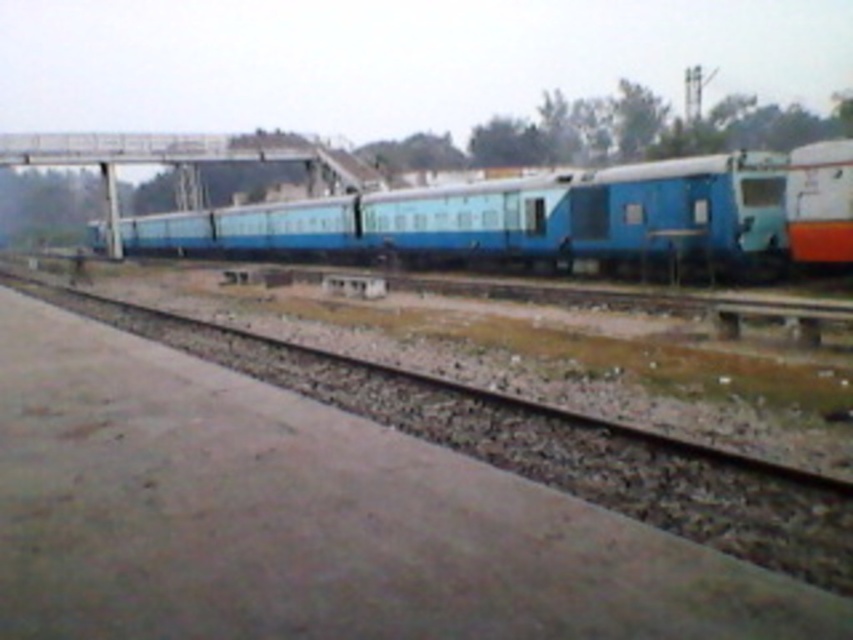
Is blue matte train car at center shorter than brown gravel track at lower left?

Incorrect, blue matte train car at center's height does not fall short of brown gravel track at lower left's.

Can you confirm if blue matte train car at center is wider than brown gravel track at lower left?

Indeed, blue matte train car at center has a greater width compared to brown gravel track at lower left.

Between point (431, 253) and point (769, 560), which one is positioned behind?

The point (431, 253) is behind.

Locate an element on the screen. This screenshot has width=853, height=640. blue matte train car at center is located at coordinates (555, 220).

Is brown gravel track at lower left wider than orange glossy train car at right?

Indeed, brown gravel track at lower left has a greater width compared to orange glossy train car at right.

What do you see at coordinates (543, 445) in the screenshot? The width and height of the screenshot is (853, 640). I see `brown gravel track at lower left` at bounding box center [543, 445].

Locate an element on the screen. brown gravel track at lower left is located at coordinates (543, 445).

Can you confirm if blue matte train car at center is positioned above orange glossy train car at right?

Yes, blue matte train car at center is above orange glossy train car at right.

Is blue matte train car at center behind orange glossy train car at right?

Yes, it is behind orange glossy train car at right.

Where is `blue matte train car at center`? The image size is (853, 640). blue matte train car at center is located at coordinates (555, 220).

Where is `blue matte train car at center`? This screenshot has height=640, width=853. blue matte train car at center is located at coordinates (555, 220).